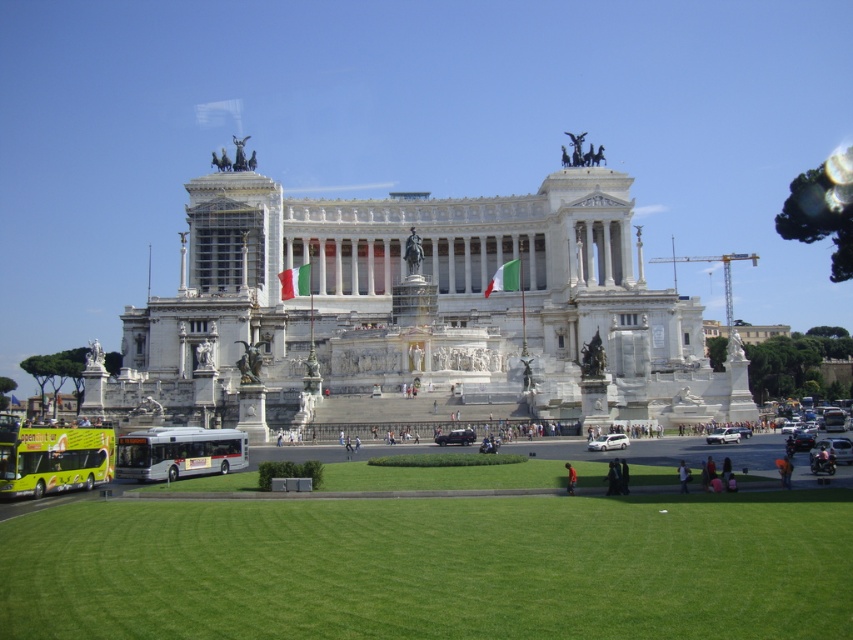
Can you confirm if white marble palace at center is wider than green grass at lower center?

Indeed, white marble palace at center has a greater width compared to green grass at lower center.

Is point (485, 275) behind point (22, 596)?

Yes, point (485, 275) is farther from viewer.

Is point (416, 218) less distant than point (479, 589)?

That is False.

The width and height of the screenshot is (853, 640). In order to click on white marble palace at center in this screenshot , I will do pyautogui.click(x=415, y=308).

Which of these two, white marble palace at center or green matte double-decker bus at lower left, stands shorter?

With less height is green matte double-decker bus at lower left.

Is white marble palace at center taller than green matte double-decker bus at lower left?

Yes, white marble palace at center is taller than green matte double-decker bus at lower left.

Describe the element at coordinates (415, 308) in the screenshot. I see `white marble palace at center` at that location.

Find the location of a particular element. white marble palace at center is located at coordinates (415, 308).

Is white marble palace at center taller than silver metallic bus at lower left?

Yes, white marble palace at center is taller than silver metallic bus at lower left.

Is point (416, 234) behind point (196, 442)?

That is True.

The height and width of the screenshot is (640, 853). In order to click on white marble palace at center in this screenshot , I will do `click(415, 308)`.